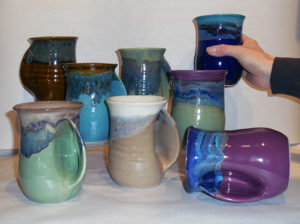
Where is `jars`? This screenshot has height=224, width=300. jars is located at coordinates (47, 136), (48, 69), (92, 94), (136, 141), (139, 78), (200, 101), (224, 155), (214, 24).